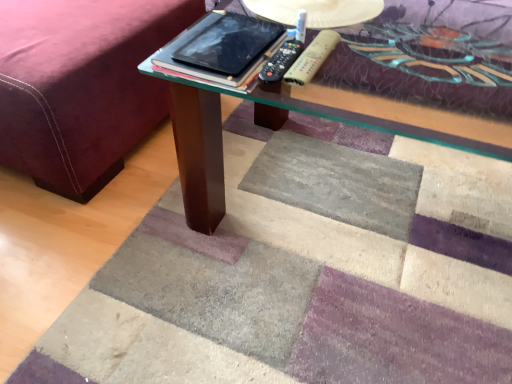
Question: Can you confirm if wooden textured remote at center, placed as the second remote when sorted from left to right, is positioned to the left of velvet maroon bed frame at lower left?

Choices:
 (A) no
 (B) yes

Answer: (A)

Question: Considering the relative sizes of wooden textured remote at center, the 1th remote from the right, and velvet maroon bed frame at lower left in the image provided, is wooden textured remote at center, the 1th remote from the right, bigger than velvet maroon bed frame at lower left?

Choices:
 (A) yes
 (B) no

Answer: (B)

Question: Is wooden textured remote at center, placed as the second remote when sorted from left to right, looking in the opposite direction of velvet maroon bed frame at lower left?

Choices:
 (A) yes
 (B) no

Answer: (B)

Question: Is wooden textured remote at center, placed as the second remote when sorted from left to right, taller than velvet maroon bed frame at lower left?

Choices:
 (A) no
 (B) yes

Answer: (A)

Question: From the image's perspective, is wooden textured remote at center, placed as the second remote when sorted from left to right, on velvet maroon bed frame at lower left?

Choices:
 (A) yes
 (B) no

Answer: (B)

Question: Is black glossy tablet at center spatially inside black plastic remote at center, which appears as the 2th remote when viewed from the right, or outside of it?

Choices:
 (A) inside
 (B) outside

Answer: (B)

Question: In terms of width, does black glossy tablet at center look wider or thinner when compared to black plastic remote at center, which appears as the 2th remote when viewed from the right?

Choices:
 (A) wide
 (B) thin

Answer: (A)

Question: In terms of height, does black glossy tablet at center look taller or shorter compared to black plastic remote at center, which appears as the 2th remote when viewed from the right?

Choices:
 (A) short
 (B) tall

Answer: (A)

Question: Considering the positions of black glossy tablet at center and black plastic remote at center, placed as the 1th remote when sorted from left to right, in the image, is black glossy tablet at center bigger or smaller than black plastic remote at center, placed as the 1th remote when sorted from left to right,?

Choices:
 (A) big
 (B) small

Answer: (A)

Question: Considering the positions of point pyautogui.click(x=280, y=34) and point pyautogui.click(x=309, y=74), is point pyautogui.click(x=280, y=34) closer or farther from the camera than point pyautogui.click(x=309, y=74)?

Choices:
 (A) farther
 (B) closer

Answer: (B)

Question: Is black glossy tablet at center situated inside wooden textured remote at center, placed as the second remote when sorted from left to right, or outside?

Choices:
 (A) inside
 (B) outside

Answer: (B)

Question: In the image, is black glossy tablet at center on the left side or the right side of wooden textured remote at center, placed as the second remote when sorted from left to right?

Choices:
 (A) left
 (B) right

Answer: (A)

Question: Is black glossy tablet at center taller or shorter than wooden textured remote at center, placed as the second remote when sorted from left to right?

Choices:
 (A) short
 (B) tall

Answer: (A)

Question: Considering the positions of black glossy tablet at center and velvet maroon bed frame at lower left in the image, is black glossy tablet at center wider or thinner than velvet maroon bed frame at lower left?

Choices:
 (A) wide
 (B) thin

Answer: (B)

Question: From a real-world perspective, is black glossy tablet at center physically located above or below velvet maroon bed frame at lower left?

Choices:
 (A) above
 (B) below

Answer: (A)